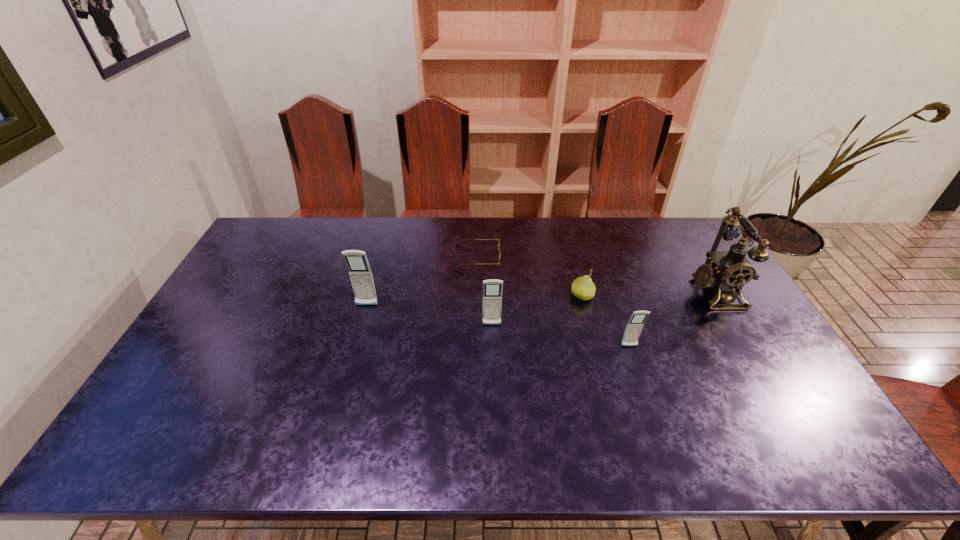
Locate an element on the screen. The image size is (960, 540). vacant area that lies between the leftmost cellular telephone and the second object from right to left is located at coordinates (498, 326).

Identify the location of empty space that is in between the shortest object and the third shortest object. The height and width of the screenshot is (540, 960). (553, 302).

The height and width of the screenshot is (540, 960). Find the location of `free space between the second shortest object and the leftmost cellular telephone`. free space between the second shortest object and the leftmost cellular telephone is located at coordinates (474, 301).

Identify the location of empty space between the nearest cellular telephone and the tallest object. The image size is (960, 540). (672, 319).

Where is `empty space between the nearest cellular telephone and the pear`? The image size is (960, 540). empty space between the nearest cellular telephone and the pear is located at coordinates (606, 321).

Image resolution: width=960 pixels, height=540 pixels. What are the coordinates of `free point between the leftmost cellular telephone and the fifth farthest object` in the screenshot? It's located at (x=429, y=315).

This screenshot has height=540, width=960. Identify the location of free space that is in between the shortest object and the second shortest object. (530, 276).

Identify which object is located as the third nearest to the nearest object. Please provide its 2D coordinates. Your answer should be formatted as a tuple, i.e. [(x, y)], where the tuple contains the x and y coordinates of a point satisfying the conditions above.

[(492, 289)]

At what (x,y) coordinates should I click in order to perform the action: click on object that is the closest to the rightmost object. Please return your answer as a coordinate pair (x, y). Image resolution: width=960 pixels, height=540 pixels. Looking at the image, I should click on click(x=635, y=324).

Point out which cellular telephone is positioned as the third nearest to the telephone. Please provide its 2D coordinates. Your answer should be formatted as a tuple, i.e. [(x, y)], where the tuple contains the x and y coordinates of a point satisfying the conditions above.

[(360, 273)]